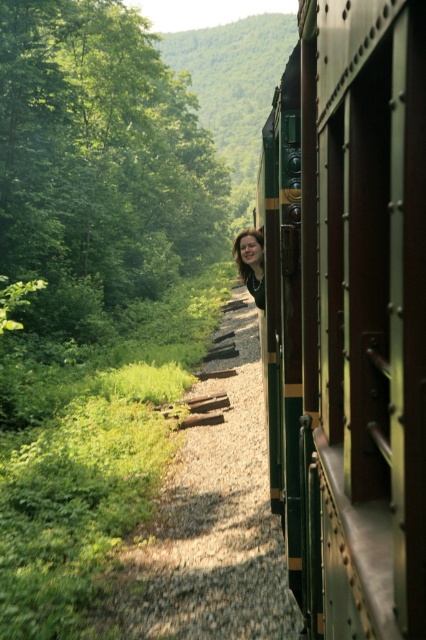
You are a passenger on the green polished wood train at right and want to look out the window to see the green leafy tree at upper left. Which direction should you look?

The green polished wood train at right is located below the green leafy tree at upper left, so you should look upward to see the green leafy tree at upper left.

You are standing on the train tracks and see the green polished wood train at right and the blonde hair at center. Which object is closer to you?

The green polished wood train at right is closer to you since it has a smaller size compared to the blonde hair at center.

You are a passenger on the train and want to know if you can safely place your backpack on the floor between the green polished wood train at right and the blonde hair at center. Can you do this?

The green polished wood train at right is thinner than blonde hair at center, so there is enough space between them to safely place your backpack.